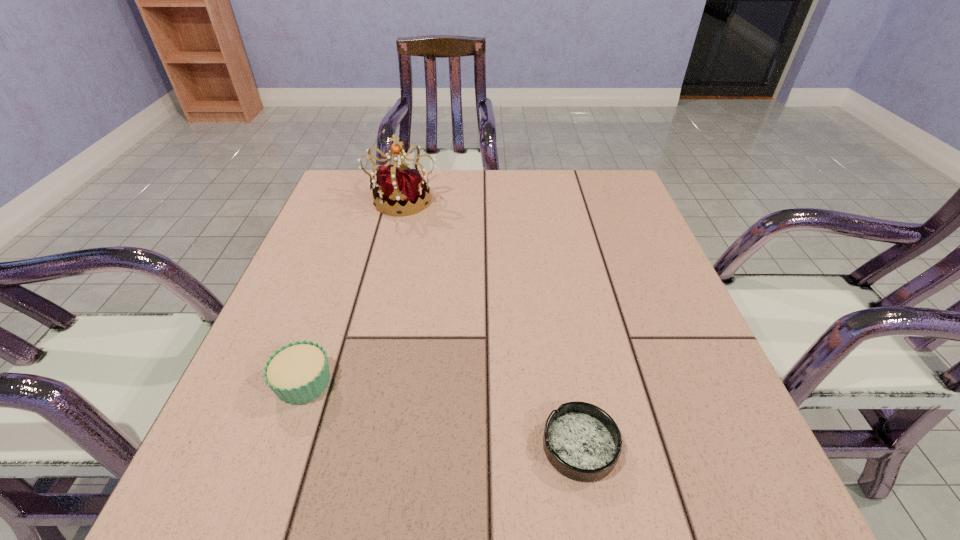
You are a GUI agent. You are given a task and a screenshot of the screen. Output one action in this format:
    pyautogui.click(x=<x>, y=<y>)
    Task: Click on the empty location between the second farthest object and the rightmost object
    The image size is (960, 540).
    Given the screenshot: What is the action you would take?
    pyautogui.click(x=442, y=414)

This screenshot has height=540, width=960. Find the location of `empty location between the shortest object and the cupcake`. empty location between the shortest object and the cupcake is located at coordinates (442, 414).

Identify the location of empty space between the cupcake and the nearest object. Image resolution: width=960 pixels, height=540 pixels. (442, 414).

The image size is (960, 540). I want to click on vacant area that lies between the tiara and the shortest object, so click(492, 322).

Locate an element on the screen. The image size is (960, 540). free space between the second nearest object and the farthest object is located at coordinates (353, 291).

The height and width of the screenshot is (540, 960). What are the coordinates of `free space between the second farthest object and the tallest object` in the screenshot? It's located at (353, 291).

I want to click on free space between the cupcake and the ashtray, so click(x=442, y=414).

The width and height of the screenshot is (960, 540). I want to click on empty space between the shortest object and the second tallest object, so click(442, 414).

Find the location of `empty space that is in between the tiara and the rightmost object`. empty space that is in between the tiara and the rightmost object is located at coordinates (492, 322).

Locate an element on the screen. Image resolution: width=960 pixels, height=540 pixels. object that can be found as the second closest to the rightmost object is located at coordinates (402, 189).